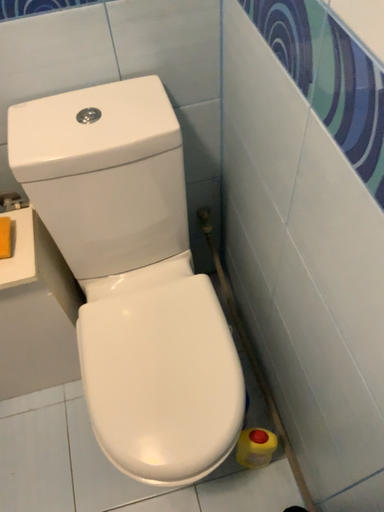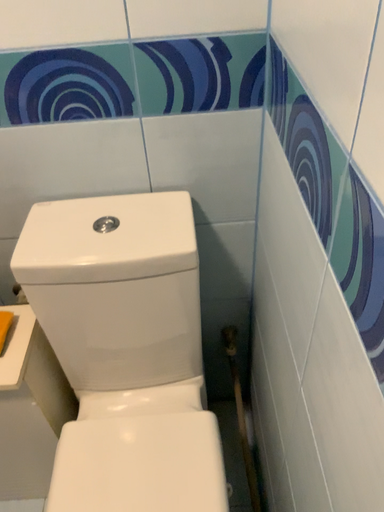
Question: How did the camera likely rotate when shooting the video?

Choices:
 (A) rotated downward
 (B) rotated upward

Answer: (B)